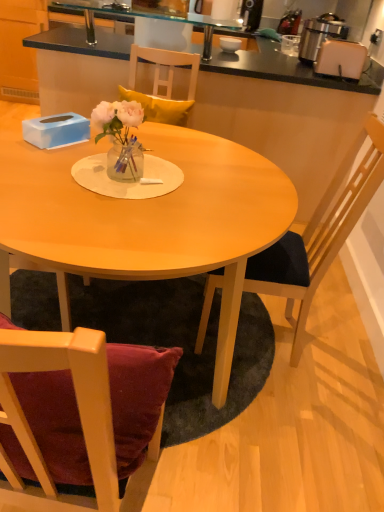
At what (x,y) coordinates should I click in order to perform the action: click on unoccupied space behind white glossy bowl at upper center. Please return your answer as a coordinate pair (x, y). The height and width of the screenshot is (512, 384). Looking at the image, I should click on (230, 48).